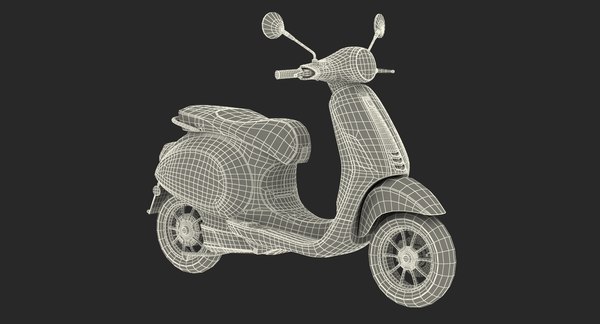
Locate an element on the screen. left handle is located at coordinates (388, 70).